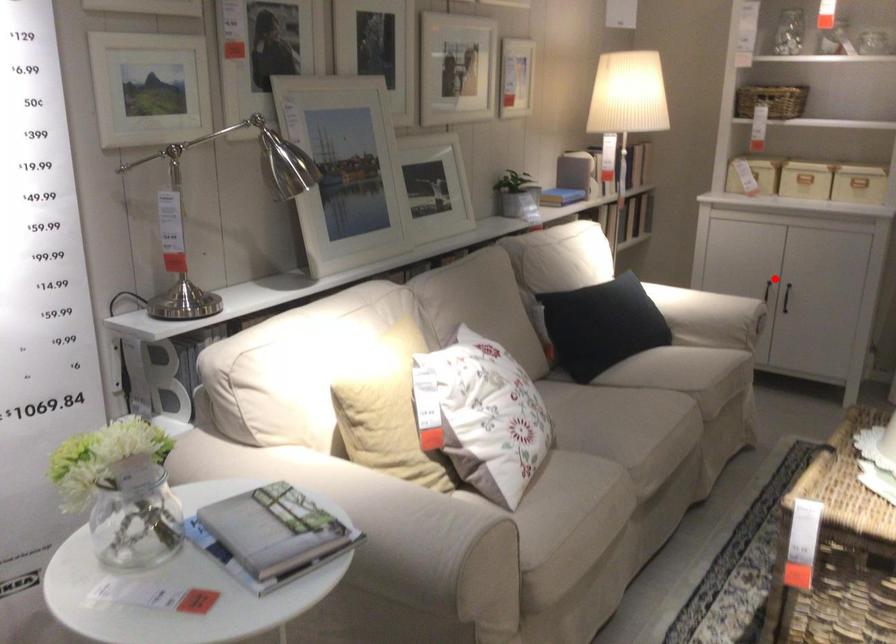
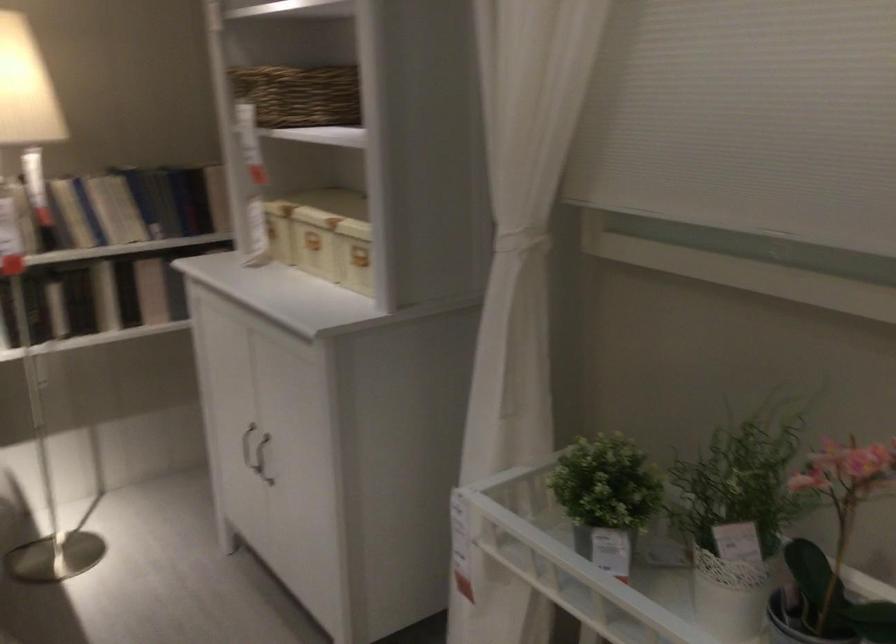
Question: I am providing you with two images of the same scene from different viewpoints. A red point is shown in image1. For the corresponding object point in image2, is it positioned nearer or farther from the camera?

Choices:
 (A) Nearer
 (B) Farther

Answer: (A)